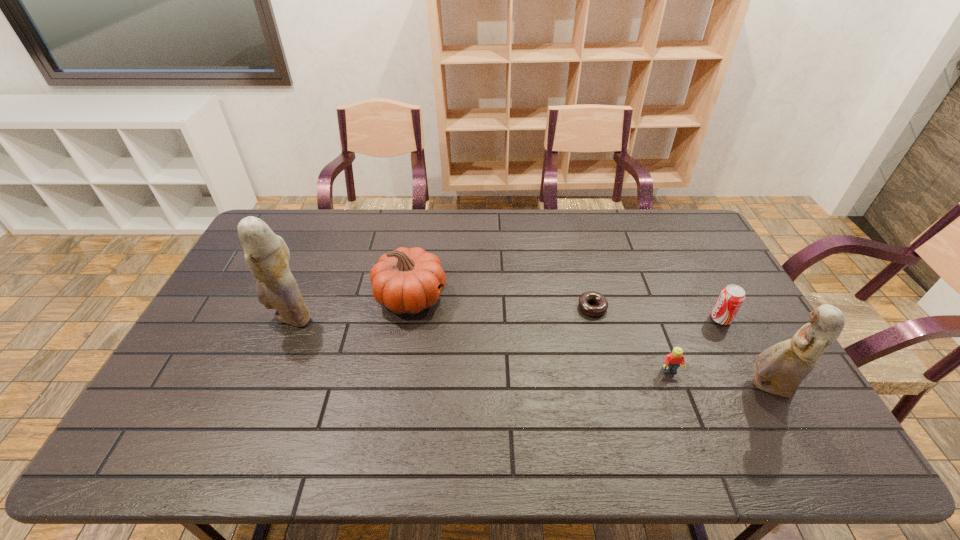
The height and width of the screenshot is (540, 960). Identify the location of the fifth tallest object. (672, 361).

This screenshot has width=960, height=540. I want to click on free space located on the front-facing side of the taller figurine, so click(x=252, y=318).

Locate an element on the screen. vacant space located 0.310m on the front-facing side of the nearer figurine is located at coordinates click(629, 387).

Locate an element on the screen. This screenshot has height=540, width=960. free space located 0.160m on the front-facing side of the nearer figurine is located at coordinates (685, 387).

Where is `free space located on the front-facing side of the nearer figurine`? The height and width of the screenshot is (540, 960). free space located on the front-facing side of the nearer figurine is located at coordinates (660, 387).

Where is `vacant space positioned 0.090m on the left of the doughnut`? The width and height of the screenshot is (960, 540). vacant space positioned 0.090m on the left of the doughnut is located at coordinates (548, 308).

The height and width of the screenshot is (540, 960). I want to click on free space located 0.160m on the face of the third tallest object, so click(497, 297).

Find the location of `blank space located on the logo side of the soda can`. blank space located on the logo side of the soda can is located at coordinates (687, 319).

Find the location of a particular element. blank space located on the logo side of the soda can is located at coordinates (585, 319).

At what (x,y) coordinates should I click in order to perform the action: click on vacant space located 0.260m on the logo side of the soda can. Please return your answer as a coordinate pair (x, y). The height and width of the screenshot is (540, 960). Looking at the image, I should click on (625, 319).